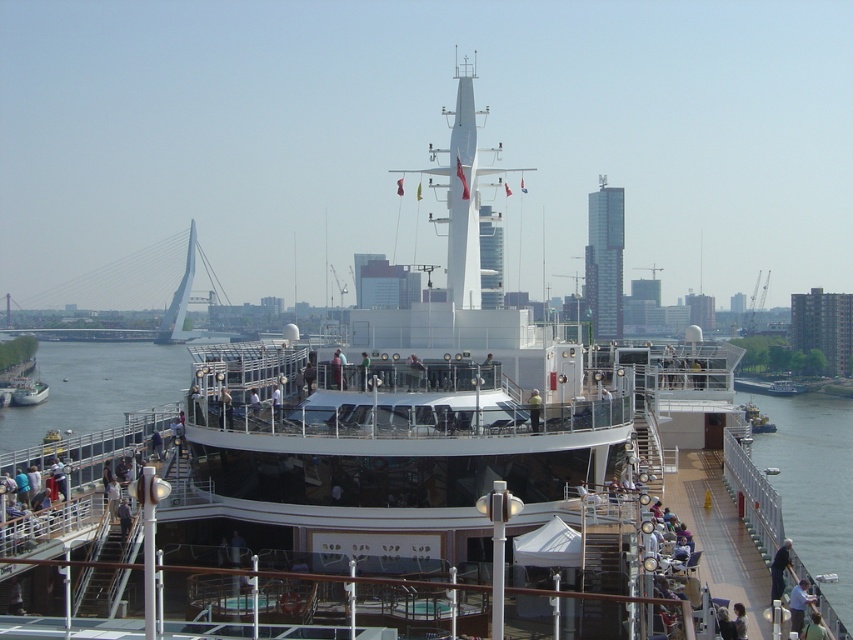
Question: Which object is positioned farthest from the light brown leather jacket at lower right?

Choices:
 (A) dark blue fabric jacket at lower right
 (B) green water at lower right

Answer: (B)

Question: Which of the following is the closest to the observer?

Choices:
 (A) yellow reflective vest at center
 (B) light brown leather jacket at lower right
 (C) dark blue fabric jacket at lower right
 (D) green water at lower right

Answer: (B)

Question: Does green water at lower right have a lesser width compared to light brown leather jacket at lower right?

Choices:
 (A) yes
 (B) no

Answer: (B)

Question: In this image, where is green water at lower right located relative to yellow reflective vest at center?

Choices:
 (A) below
 (B) above

Answer: (A)

Question: Which object is positioned closest to the dark blue fabric jacket at lower right?

Choices:
 (A) green water at lower right
 (B) yellow reflective vest at center

Answer: (B)

Question: Does light brown leather jacket at lower right have a lesser width compared to yellow reflective vest at center?

Choices:
 (A) yes
 (B) no

Answer: (B)